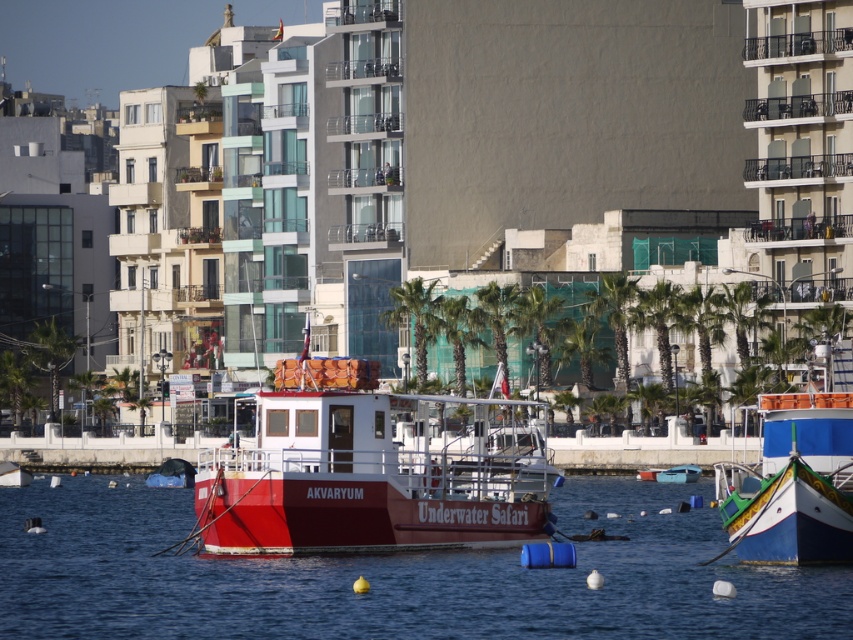
Which of these two, transparent blue water at center or red matte boat at center, stands taller?

red matte boat at center is taller.

Can you confirm if transparent blue water at center is positioned above red matte boat at center?

Actually, transparent blue water at center is below red matte boat at center.

At what (x,y) coordinates should I click in order to perform the action: click on transparent blue water at center. Please return your answer as a coordinate pair (x, y). Image resolution: width=853 pixels, height=640 pixels. Looking at the image, I should click on (393, 577).

Where is `transparent blue water at center`? The height and width of the screenshot is (640, 853). transparent blue water at center is located at coordinates (393, 577).

Between point (107, 490) and point (775, 435), which one is positioned in front?

Point (775, 435)

The image size is (853, 640). Describe the element at coordinates (393, 577) in the screenshot. I see `transparent blue water at center` at that location.

Where is `transparent blue water at center`? Image resolution: width=853 pixels, height=640 pixels. transparent blue water at center is located at coordinates (393, 577).

How distant is red matte boat at center from blue painted wooden boat at lower right?

13.45 meters

Describe the element at coordinates (374, 468) in the screenshot. I see `red matte boat at center` at that location.

The height and width of the screenshot is (640, 853). Identify the location of red matte boat at center. (374, 468).